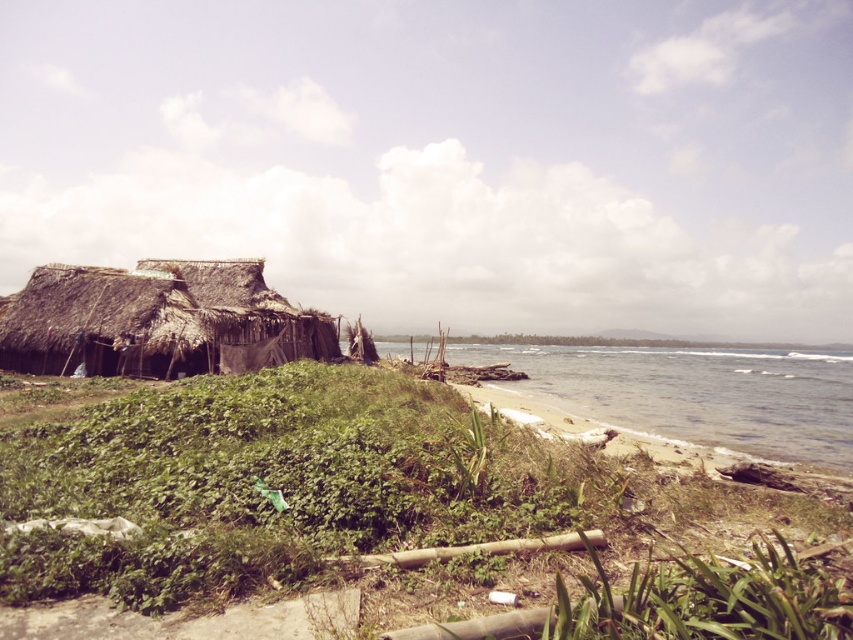
Question: Does green grass at lower left have a larger size compared to clear water at lower right?

Choices:
 (A) no
 (B) yes

Answer: (A)

Question: Based on their relative distances, which object is farther from the thatched straw hut at left?

Choices:
 (A) green grass at lower left
 (B) clear water at lower right

Answer: (B)

Question: Can you confirm if green grass at lower left is thinner than thatched straw hut at left?

Choices:
 (A) no
 (B) yes

Answer: (A)

Question: Which object is closer to the camera taking this photo?

Choices:
 (A) clear water at lower right
 (B) green grass at lower left

Answer: (B)

Question: Which point is farther to the camera?

Choices:
 (A) clear water at lower right
 (B) thatched straw hut at left
 (C) green grass at lower left

Answer: (B)

Question: Is clear water at lower right above thatched straw hut at left?

Choices:
 (A) yes
 (B) no

Answer: (B)